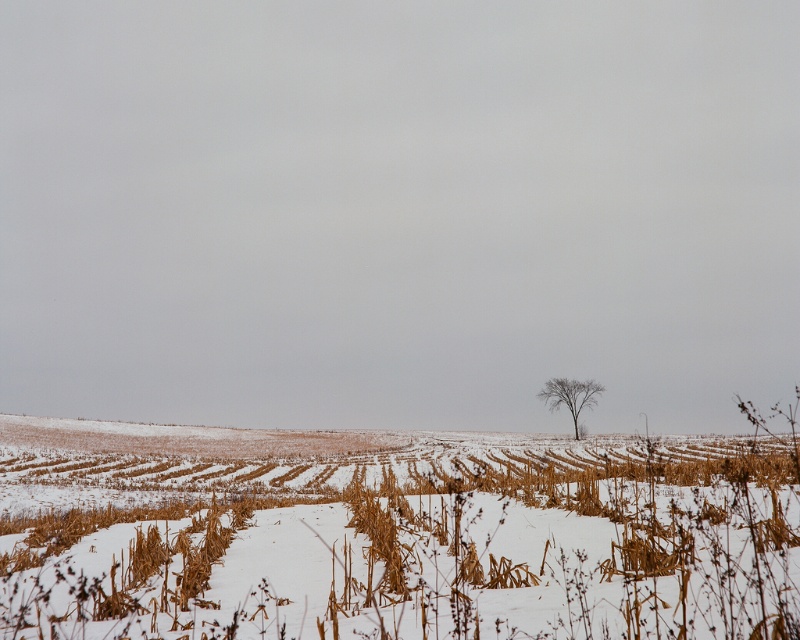
Who is taller, brown grass at center or bare branches at center?

With more height is brown grass at center.

Image resolution: width=800 pixels, height=640 pixels. Find the location of `brown grass at center`. brown grass at center is located at coordinates (392, 534).